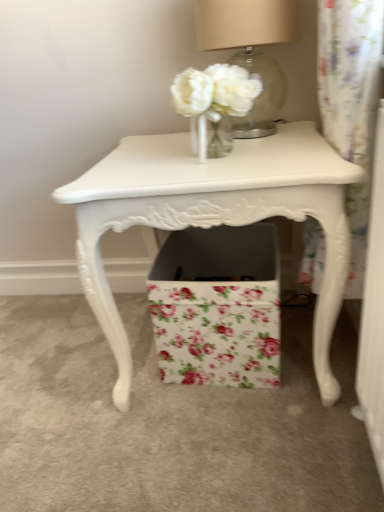
At what (x,y) coordinates should I click in order to perform the action: click on vacant space positioned to the left of matte beige lampshade at upper center. Please return your answer as a coordinate pair (x, y). Looking at the image, I should click on (157, 141).